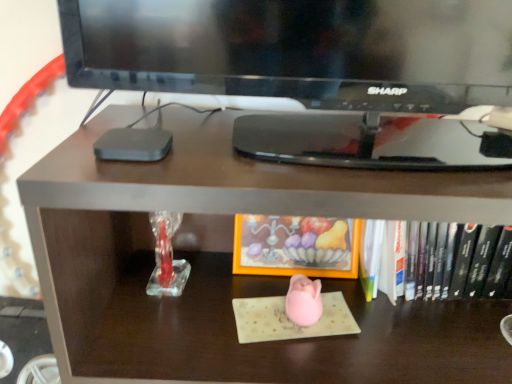
Where is `hardcover book at center, which appears as the first book when viewed from the right`? Image resolution: width=512 pixels, height=384 pixels. hardcover book at center, which appears as the first book when viewed from the right is located at coordinates (447, 260).

How much space does hardcover book at center, which appears as the first book when viewed from the right, occupy horizontally?

hardcover book at center, which appears as the first book when viewed from the right, is 7.38 inches in width.

The image size is (512, 384). In order to click on hardcover book at center, which appears as the first book when viewed from the right in this screenshot , I will do (x=447, y=260).

Considering the positions of objects orange matte frame at center, acting as the second book starting from the right, and hardcover book at center, which is the 2th book from left to right, in the image provided, who is more to the left, orange matte frame at center, acting as the second book starting from the right, or hardcover book at center, which is the 2th book from left to right,?

Positioned to the left is orange matte frame at center, acting as the second book starting from the right.

What's the angular difference between orange matte frame at center, which is counted as the 1th book, starting from the left, and hardcover book at center, which appears as the first book when viewed from the right,'s facing directions?

0.0751 degrees.

Considering the positions of objects orange matte frame at center, acting as the second book starting from the right, and hardcover book at center, which appears as the first book when viewed from the right, in the image provided, who is behind, orange matte frame at center, acting as the second book starting from the right, or hardcover book at center, which appears as the first book when viewed from the right,?

orange matte frame at center, acting as the second book starting from the right, is behind.

Is orange matte frame at center, acting as the second book starting from the right, beside hardcover book at center, which appears as the first book when viewed from the right?

No, orange matte frame at center, acting as the second book starting from the right, is not in contact with hardcover book at center, which appears as the first book when viewed from the right.

Based on the photo, from a real-world perspective, is hardcover book at center, which is the 2th book from left to right, over matte brown desk at center?

Yes, from a real-world perspective, hardcover book at center, which is the 2th book from left to right, is above matte brown desk at center.

Image resolution: width=512 pixels, height=384 pixels. What are the coordinates of `book on the right of matte brown desk at center` in the screenshot? It's located at (447, 260).

Looking at their sizes, would you say hardcover book at center, which appears as the first book when viewed from the right, is wider or thinner than matte brown desk at center?

hardcover book at center, which appears as the first book when viewed from the right, is thinner than matte brown desk at center.

Which of these two, hardcover book at center, which is the 2th book from left to right, or matte brown desk at center, stands taller?

Standing taller between the two is matte brown desk at center.

Relative to orange matte frame at center, which is counted as the 1th book, starting from the left, is matte brown desk at center in front or behind?

Visually, matte brown desk at center is located in front of orange matte frame at center, which is counted as the 1th book, starting from the left.

From a real-world perspective, which is physically above, matte brown desk at center or orange matte frame at center, acting as the second book starting from the right?

In real-world perspective, orange matte frame at center, acting as the second book starting from the right, is above.

Does point (179, 113) come in front of point (356, 243)?

No, (179, 113) is behind (356, 243).

Which point is more distant from viewer, [429,282] or [251,244]?

Point [251,244]

From a real-world perspective, which is physically above, hardcover book at center, which appears as the first book when viewed from the right, or orange matte frame at center, acting as the second book starting from the right?

orange matte frame at center, acting as the second book starting from the right, from a real-world perspective.

Can you tell me how much hardcover book at center, which appears as the first book when viewed from the right, and orange matte frame at center, acting as the second book starting from the right, differ in facing direction?

hardcover book at center, which appears as the first book when viewed from the right, and orange matte frame at center, acting as the second book starting from the right, are facing 0.0751 degrees away from each other.

Is orange matte frame at center, which is counted as the 1th book, starting from the left, facing away from matte brown desk at center?

Correct, orange matte frame at center, which is counted as the 1th book, starting from the left, is looking away from matte brown desk at center.

From a real-world perspective, which object rests below the other?

matte brown desk at center.

Considering the points (309, 223) and (412, 377), which point is in front, point (309, 223) or point (412, 377)?

The point (412, 377) is more forward.

From a real-world perspective, is matte brown desk at center physically above hardcover book at center, which appears as the first book when viewed from the right?

Incorrect, from a real-world perspective, matte brown desk at center is lower than hardcover book at center, which appears as the first book when viewed from the right.

How many degrees apart are the facing directions of matte brown desk at center and hardcover book at center, which is the 2th book from left to right?

matte brown desk at center and hardcover book at center, which is the 2th book from left to right, are facing 0.638 degrees away from each other.

Is matte brown desk at center facing away from hardcover book at center, which is the 2th book from left to right?

Yes, matte brown desk at center is facing away from hardcover book at center, which is the 2th book from left to right.

You are a GUI agent. You are given a task and a screenshot of the screen. Output one action in this format:
    pyautogui.click(x=<x>, y=<y>)
    Task: Click on the book lying below the orange matte frame at center, which is counted as the 1th book, starting from the left (from the image's perspective)
    The width and height of the screenshot is (512, 384).
    Given the screenshot: What is the action you would take?
    pyautogui.click(x=447, y=260)

There is a matte brown desk at center. Where is `the 1st book above it (from a real-world perspective)`? This screenshot has height=384, width=512. the 1st book above it (from a real-world perspective) is located at coordinates (447, 260).

Based on their spatial positions, is hardcover book at center, which appears as the first book when viewed from the right, or orange matte frame at center, acting as the second book starting from the right, closer to matte brown desk at center?

orange matte frame at center, acting as the second book starting from the right.

Consider the image. Estimate the real-world distances between objects in this image. Which object is closer to hardcover book at center, which appears as the first book when viewed from the right, orange matte frame at center, which is counted as the 1th book, starting from the left, or matte brown desk at center?

orange matte frame at center, which is counted as the 1th book, starting from the left.

Based on the photo, looking at the image, which one is located further to orange matte frame at center, which is counted as the 1th book, starting from the left, matte brown desk at center or hardcover book at center, which appears as the first book when viewed from the right?

matte brown desk at center is positioned further to the anchor orange matte frame at center, which is counted as the 1th book, starting from the left.

Looking at the image, which one is located closer to hardcover book at center, which appears as the first book when viewed from the right, matte brown desk at center or orange matte frame at center, acting as the second book starting from the right?

Among the two, orange matte frame at center, acting as the second book starting from the right, is located nearer to hardcover book at center, which appears as the first book when viewed from the right.

Which object lies nearer to the anchor point orange matte frame at center, acting as the second book starting from the right, hardcover book at center, which is the 2th book from left to right, or matte brown desk at center?

hardcover book at center, which is the 2th book from left to right, is closer to orange matte frame at center, acting as the second book starting from the right.

When comparing their distances from matte brown desk at center, does orange matte frame at center, acting as the second book starting from the right, or hardcover book at center, which is the 2th book from left to right, seem further?

The object further to matte brown desk at center is hardcover book at center, which is the 2th book from left to right.

You are a GUI agent. You are given a task and a screenshot of the screen. Output one action in this format:
    pyautogui.click(x=<x>, y=<y>)
    Task: Click on the book between matte brown desk at center and orange matte frame at center, acting as the second book starting from the right, along the z-axis
    This screenshot has height=384, width=512.
    Given the screenshot: What is the action you would take?
    pyautogui.click(x=447, y=260)